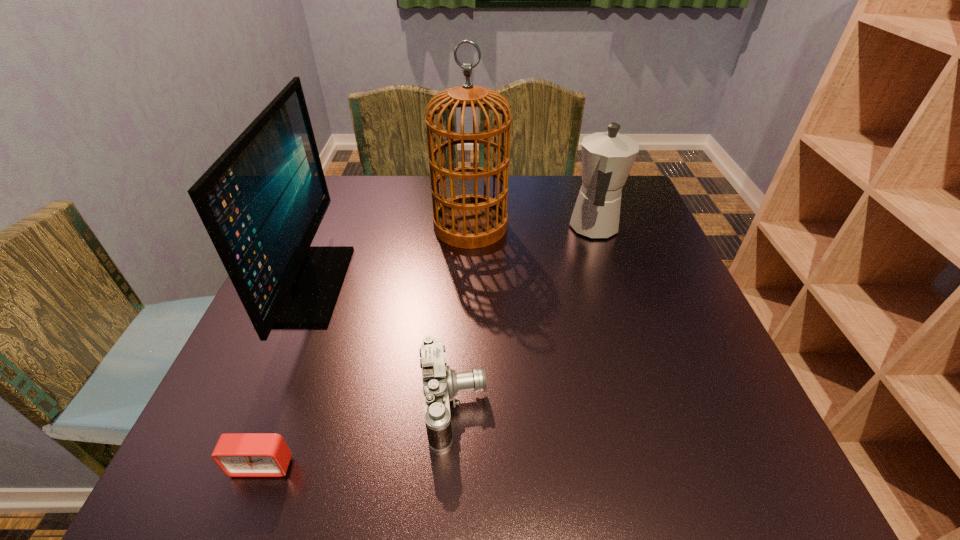
This screenshot has width=960, height=540. I want to click on vacant space at the near edge, so click(291, 472).

You are a GUI agent. You are given a task and a screenshot of the screen. Output one action in this format:
    pyautogui.click(x=<x>, y=<y>)
    Task: Click on the vacant area at the left edge of the desktop
    This screenshot has width=960, height=540.
    Given the screenshot: What is the action you would take?
    pyautogui.click(x=235, y=377)

This screenshot has width=960, height=540. Find the location of `free space at the right edge of the desktop`. free space at the right edge of the desktop is located at coordinates (728, 377).

In order to click on free space at the far left corner of the desktop in this screenshot , I will do `click(362, 198)`.

At what (x,y) coordinates should I click in order to perform the action: click on unoccupied area between the second tallest object and the camera. Please return your answer as a coordinate pair (x, y). The image size is (960, 540). Looking at the image, I should click on (381, 345).

You are a GUI agent. You are given a task and a screenshot of the screen. Output one action in this format:
    pyautogui.click(x=<x>, y=<y>)
    Task: Click on the free space between the shortest object and the tallest object
    This screenshot has height=540, width=960.
    Given the screenshot: What is the action you would take?
    pyautogui.click(x=367, y=346)

Image resolution: width=960 pixels, height=540 pixels. I want to click on empty space that is in between the fourth tallest object and the coffeepot, so click(524, 316).

At what (x,y) coordinates should I click in order to perform the action: click on empty location between the shortest object and the tallest object. Please return your answer as a coordinate pair (x, y). Looking at the image, I should click on (367, 346).

Find the location of `blank region between the monitor and the fourth tallest object`. blank region between the monitor and the fourth tallest object is located at coordinates (381, 345).

Find the location of a particular element. free space between the monitor and the coffeepot is located at coordinates (451, 256).